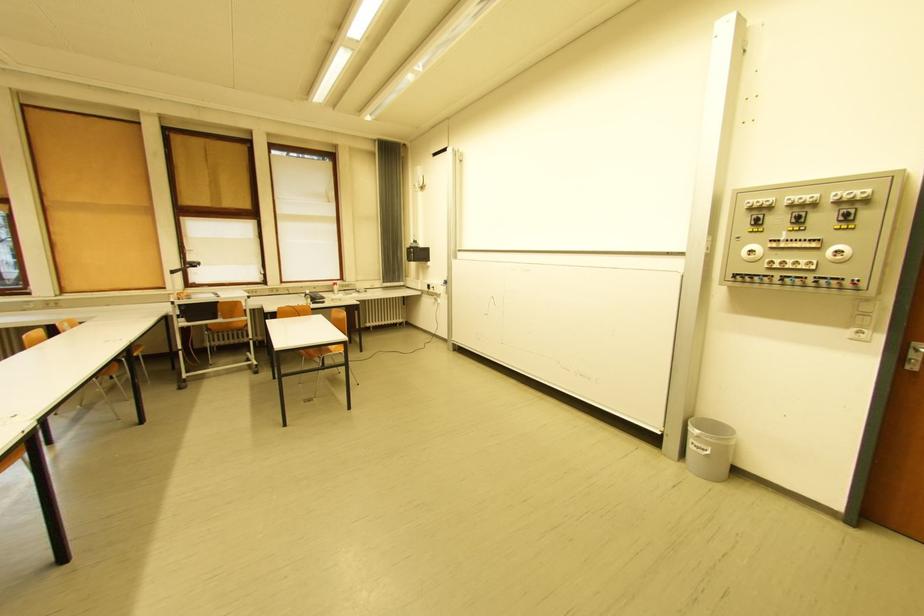
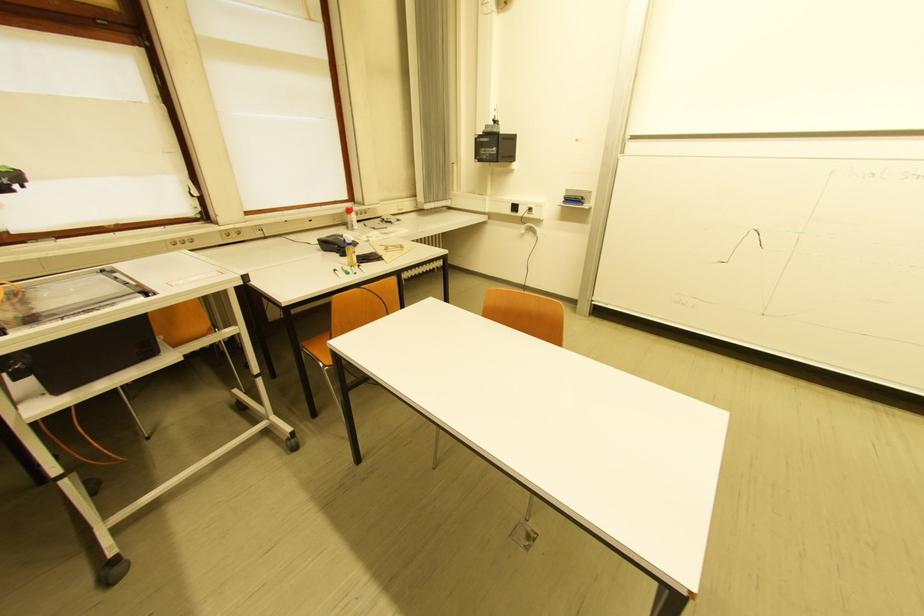
In the second image, find the point that corresponds to (x=339, y=293) in the first image.

(351, 225)